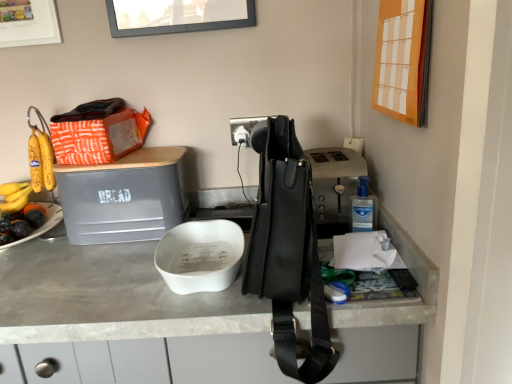
Question: Is black plastic power outlet at center inside white matte bowl at center?

Choices:
 (A) yes
 (B) no

Answer: (B)

Question: Can you confirm if white matte bowl at center is thinner than black plastic power outlet at center?

Choices:
 (A) no
 (B) yes

Answer: (A)

Question: Does white matte bowl at center have a greater width compared to black plastic power outlet at center?

Choices:
 (A) no
 (B) yes

Answer: (B)

Question: Is white matte bowl at center positioned with its back to black plastic power outlet at center?

Choices:
 (A) yes
 (B) no

Answer: (B)

Question: Can you confirm if white matte bowl at center is shorter than black plastic power outlet at center?

Choices:
 (A) no
 (B) yes

Answer: (A)

Question: From the image's perspective, is white matte bowl at center located above or below black leather handbag at center?

Choices:
 (A) above
 (B) below

Answer: (B)

Question: Would you say white matte bowl at center is to the left or to the right of black leather handbag at center in the picture?

Choices:
 (A) left
 (B) right

Answer: (A)

Question: In the image, is white matte bowl at center positioned in front of or behind black leather handbag at center?

Choices:
 (A) front
 (B) behind

Answer: (B)

Question: Is white matte bowl at center spatially inside black leather handbag at center, or outside of it?

Choices:
 (A) inside
 (B) outside

Answer: (B)

Question: Considering their positions, is orange paper calendar at upper right, which ranks as the second picture frame in top-to-bottom order, located in front of or behind black leather handbag at center?

Choices:
 (A) behind
 (B) front

Answer: (A)

Question: Would you say orange paper calendar at upper right, positioned as the second picture frame in left-to-right order, is to the left or to the right of black leather handbag at center in the picture?

Choices:
 (A) right
 (B) left

Answer: (A)

Question: Is point (382, 67) closer or farther from the camera than point (290, 226)?

Choices:
 (A) farther
 (B) closer

Answer: (A)

Question: In terms of width, does orange paper calendar at upper right, placed as the 2th picture frame when sorted from back to front, look wider or thinner when compared to black leather handbag at center?

Choices:
 (A) wide
 (B) thin

Answer: (B)

Question: From the image's perspective, relative to orange paper calendar at upper right, which ranks as the first picture frame in right-to-left order, is black leather handbag at center above or below?

Choices:
 (A) below
 (B) above

Answer: (A)

Question: From their relative heights in the image, would you say black leather handbag at center is taller or shorter than orange paper calendar at upper right, placed as the 2th picture frame when sorted from back to front?

Choices:
 (A) short
 (B) tall

Answer: (B)